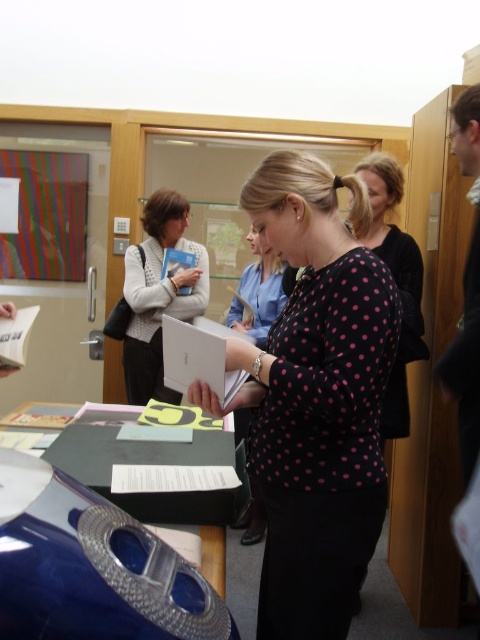
Question: Which point is closer to the camera?

Choices:
 (A) (140, 316)
 (B) (312, 573)

Answer: (B)

Question: Can you confirm if multicolored striped paper at left is smaller than shiny blue table at center?

Choices:
 (A) no
 (B) yes

Answer: (A)

Question: Does black dotted shirt at center lie behind multicolored striped paper at left?

Choices:
 (A) yes
 (B) no

Answer: (B)

Question: Which point is closer to the camera taking this photo?

Choices:
 (A) (154, 332)
 (B) (6, 240)
 (C) (206, 538)

Answer: (C)

Question: Which is nearer to the shiny blue table at center?

Choices:
 (A) multicolored striped paper at left
 (B) black dotted shirt at center
 (C) white knitted sweater at center

Answer: (C)

Question: Does black dotted shirt at center come in front of multicolored striped paper at left?

Choices:
 (A) yes
 (B) no

Answer: (A)